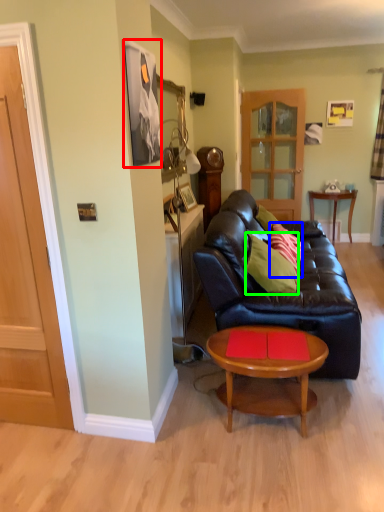
Question: Which object is positioned closest to picture frame (highlighted by a red box)? Select from pillow (highlighted by a blue box) and pillow (highlighted by a green box).

Choices:
 (A) pillow
 (B) pillow

Answer: (B)